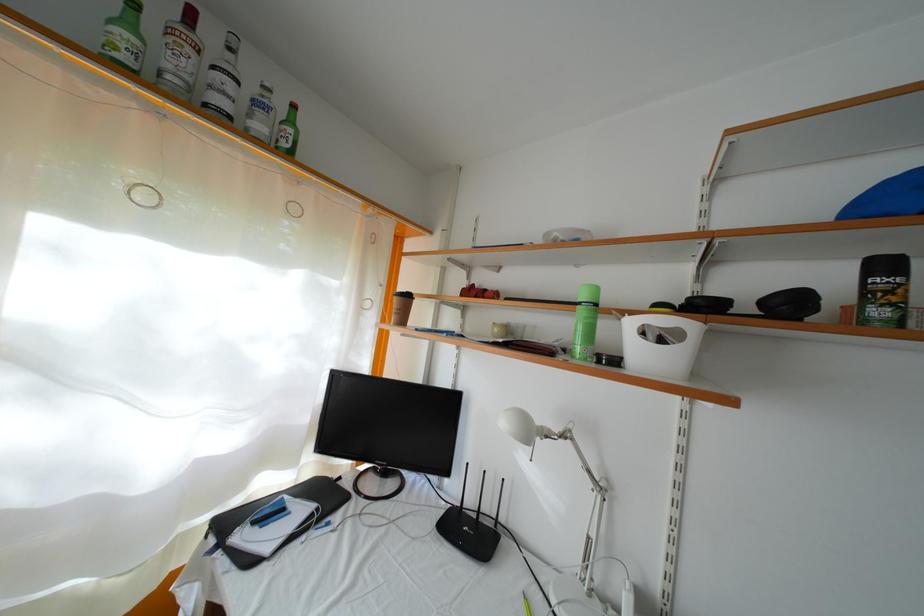
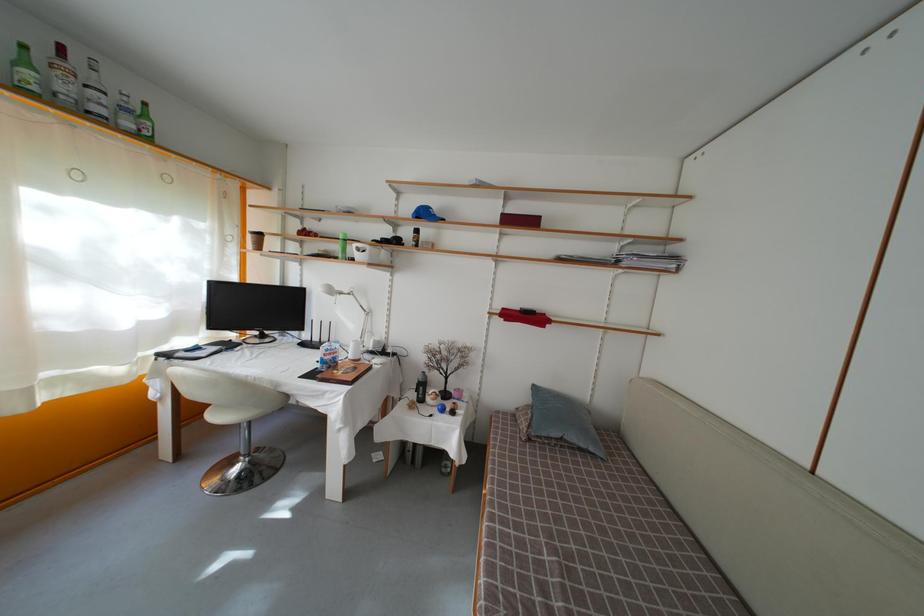
The point at (568, 442) is marked in the first image. Where is the corresponding point in the second image?

(355, 301)